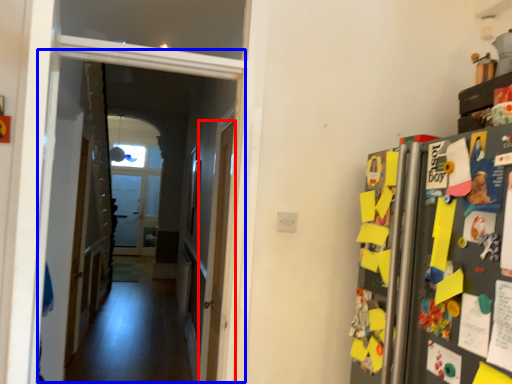
Question: Which object appears farthest to the camera in this image, door (highlighted by a red box) or corridor (highlighted by a blue box)?

Choices:
 (A) door
 (B) corridor

Answer: (A)